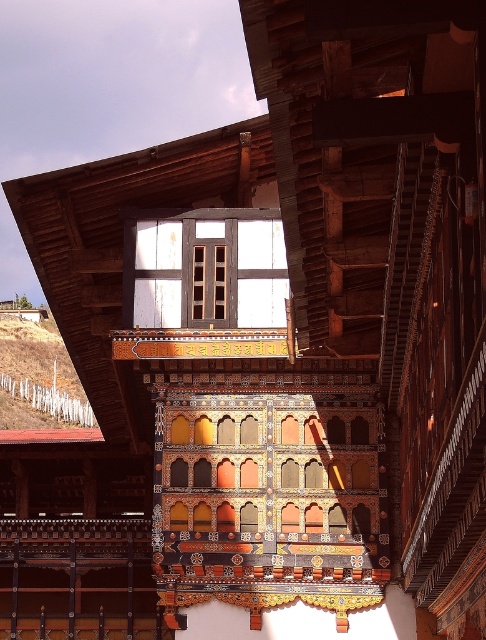
Between white painted wood at center and brown grass at lower left, which one is positioned higher?

white painted wood at center is higher up.

Which is behind, point (161, 230) or point (42, 349)?

Positioned behind is point (42, 349).

Locate an element on the screen. white painted wood at center is located at coordinates (207, 269).